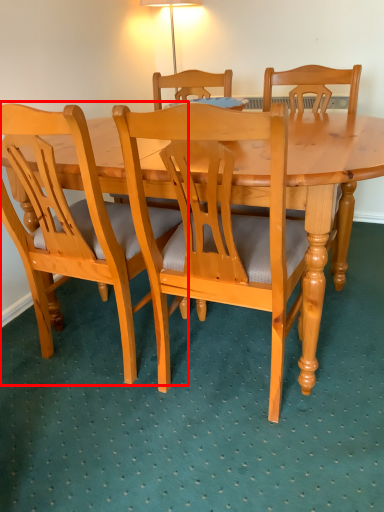
Question: From the image's perspective, what is the correct spatial relationship of chair (annotated by the red box) in relation to chair?

Choices:
 (A) below
 (B) above

Answer: (B)